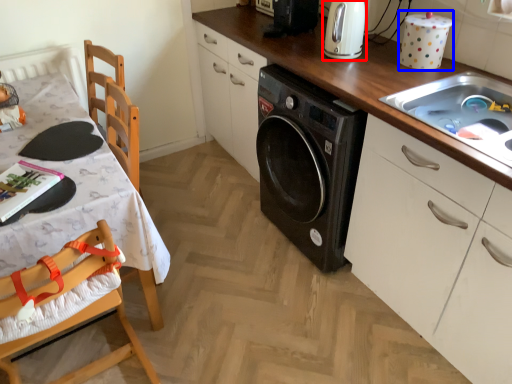
Question: Which object appears closest to the camera in this image, home appliance (highlighted by a red box) or appliance (highlighted by a blue box)?

Choices:
 (A) home appliance
 (B) appliance

Answer: (B)